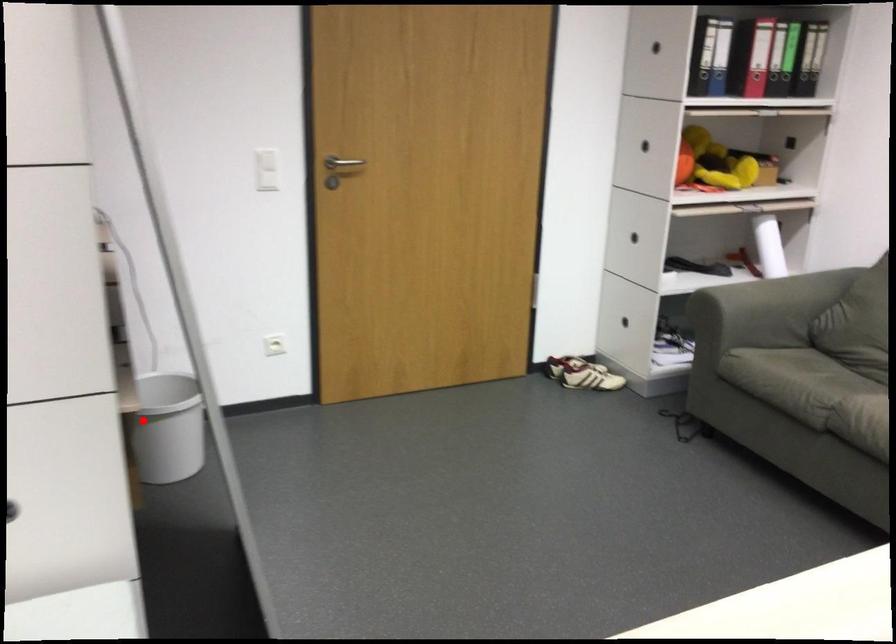
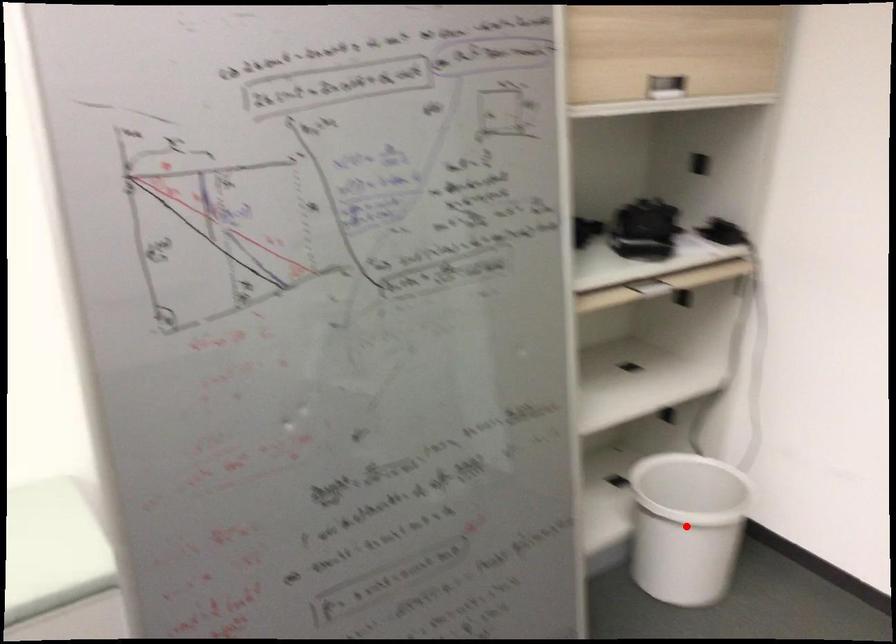
I am providing you with two images of the same scene from different viewpoints. A red point is marked on the first image and another point is marked on the second image. Is the marked point in image1 the same physical position as the marked point in image2?

Yes